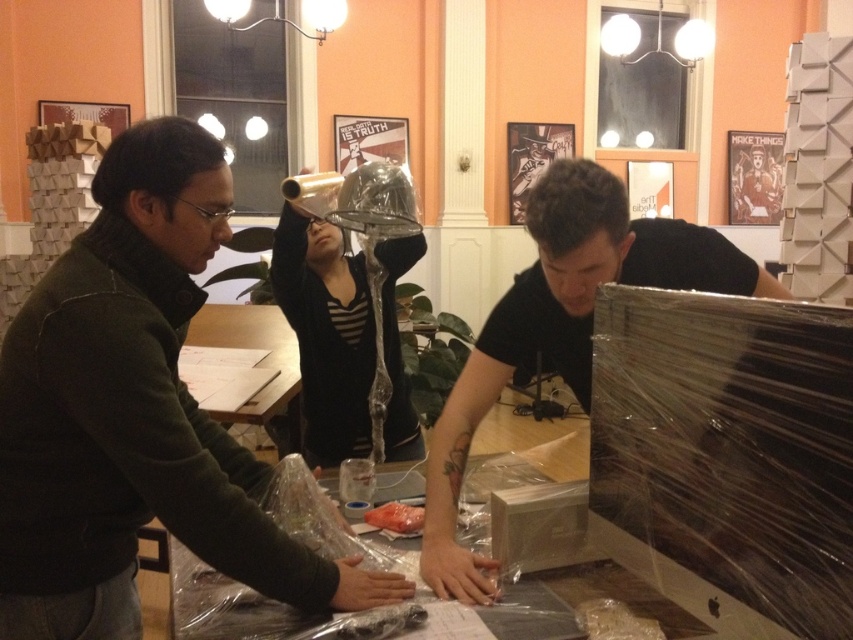
What are the coordinates of the clear plastic bag at center?

The clear plastic bag at center is located at point (344,333).

You are organizing a small event and need to place a decorative centerpiece on the clear plastic table at center. The centerpiece requires a minimum width of 30 cm to fit properly. Given that the clear plastic bag at center is placed on the table, can the table accommodate the centerpiece?

The clear plastic bag at center has a width less than the clear plastic table at center, meaning the table is wider. Since the table is wider than the bag, it should be able to accommodate the 30 cm centerpiece, provided the bag isn not occupying the entire surface. However, the exact dimensions aren unknown, so check the table size before placing the centerpiece.